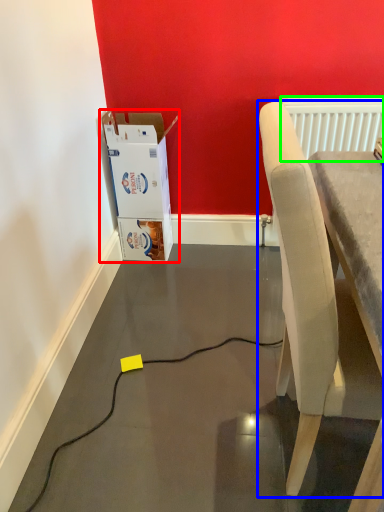
Question: Estimate the real-world distances between objects in this image. Which object is closer to cardboard box (highlighted by a red box), chair (highlighted by a blue box) or radiator (highlighted by a green box)?

Choices:
 (A) chair
 (B) radiator

Answer: (B)